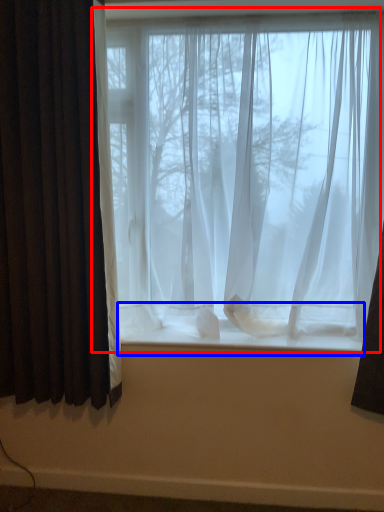
Question: Among these objects, which one is farthest to the camera, window (highlighted by a red box) or window sill (highlighted by a blue box)?

Choices:
 (A) window
 (B) window sill

Answer: (B)